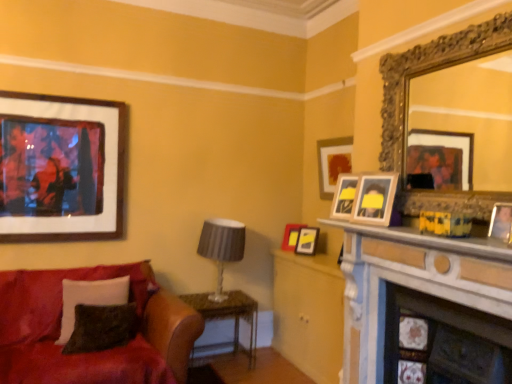
Question: Is the depth of velvety black pillow at lower left, which appears as the second pillow when viewed from the front, greater than that of satin red couch at lower left?

Choices:
 (A) no
 (B) yes

Answer: (B)

Question: Can satin red couch at lower left be found inside velvety black pillow at lower left, the first pillow viewed from the back?

Choices:
 (A) yes
 (B) no

Answer: (B)

Question: From the image's perspective, is velvety black pillow at lower left, the first pillow viewed from the back, located beneath satin red couch at lower left?

Choices:
 (A) yes
 (B) no

Answer: (B)

Question: Considering the relative sizes of velvety black pillow at lower left, the first pillow viewed from the back, and satin red couch at lower left in the image provided, is velvety black pillow at lower left, the first pillow viewed from the back, wider than satin red couch at lower left?

Choices:
 (A) no
 (B) yes

Answer: (A)

Question: Is velvety black pillow at lower left, the first pillow viewed from the back, bigger than satin red couch at lower left?

Choices:
 (A) yes
 (B) no

Answer: (B)

Question: Are velvety black pillow at lower left, which appears as the second pillow when viewed from the front, and satin red couch at lower left making contact?

Choices:
 (A) no
 (B) yes

Answer: (A)

Question: Is gold ornate mirror at upper right oriented away from velvety black pillow at lower left, which appears as the second pillow when viewed from the front?

Choices:
 (A) yes
 (B) no

Answer: (B)

Question: Considering the relative positions of gold ornate mirror at upper right and velvety black pillow at lower left, which appears as the second pillow when viewed from the front, in the image provided, is gold ornate mirror at upper right behind velvety black pillow at lower left, which appears as the second pillow when viewed from the front,?

Choices:
 (A) no
 (B) yes

Answer: (A)

Question: From the image's perspective, is gold ornate mirror at upper right located beneath velvety black pillow at lower left, which appears as the second pillow when viewed from the front?

Choices:
 (A) yes
 (B) no

Answer: (B)

Question: Does gold ornate mirror at upper right have a lesser width compared to velvety black pillow at lower left, which appears as the second pillow when viewed from the front?

Choices:
 (A) yes
 (B) no

Answer: (A)

Question: Is gold ornate mirror at upper right far from velvety black pillow at lower left, which appears as the second pillow when viewed from the front?

Choices:
 (A) no
 (B) yes

Answer: (B)

Question: Is the depth of gold ornate mirror at upper right less than that of velvety black pillow at lower left, the first pillow viewed from the back?

Choices:
 (A) yes
 (B) no

Answer: (A)

Question: From the image's perspective, is matte gray lampshade at center located beneath wooden framed artwork at upper left, the fifth picture frame when ordered from right to left?

Choices:
 (A) no
 (B) yes

Answer: (B)